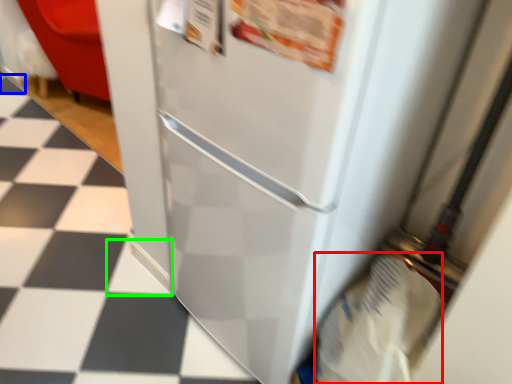
Question: Which is farther away from grocery bag (highlighted by a red box)? tile (highlighted by a blue box) or tile (highlighted by a green box)?

Choices:
 (A) tile
 (B) tile

Answer: (A)